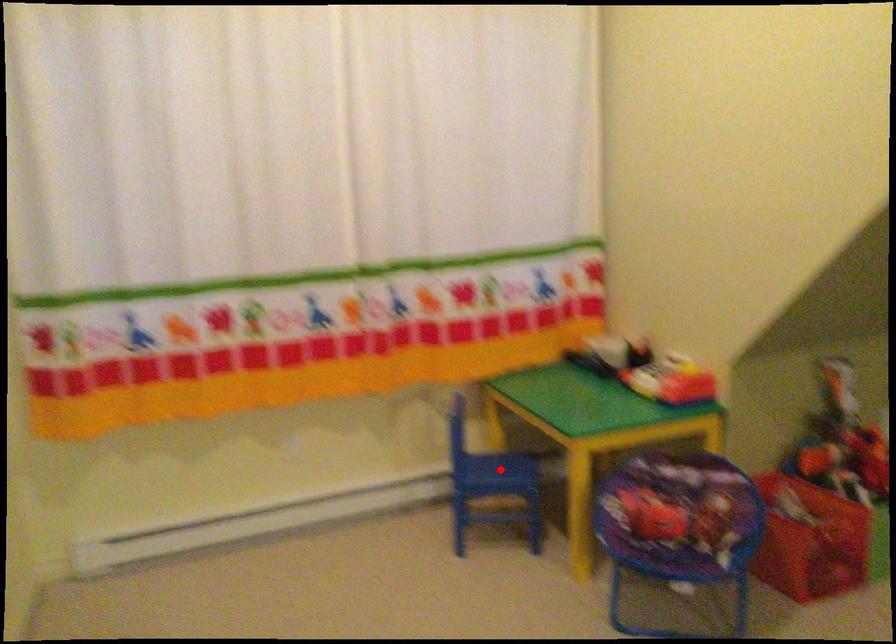
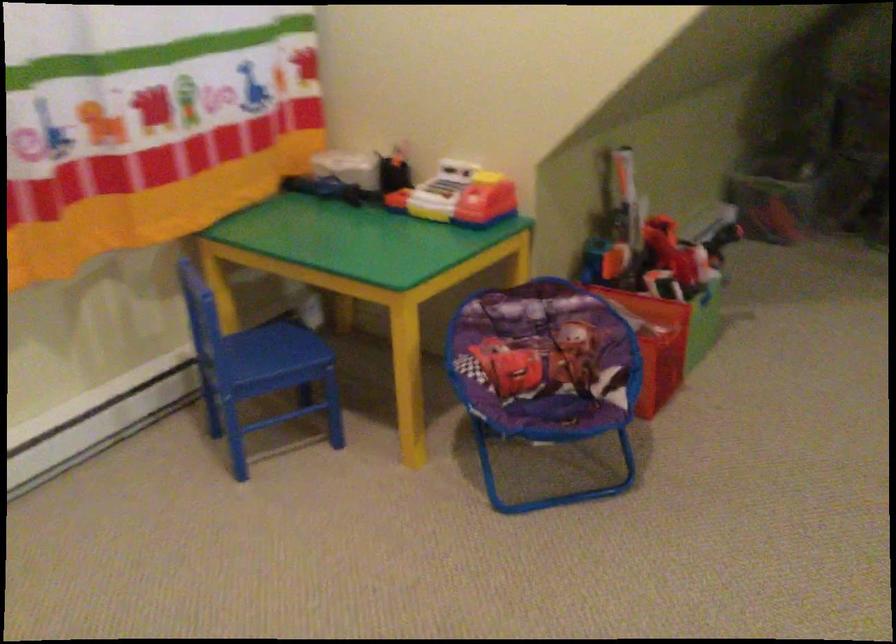
In the second image, find the point that corresponds to the highlighted location in the first image.

(274, 348)